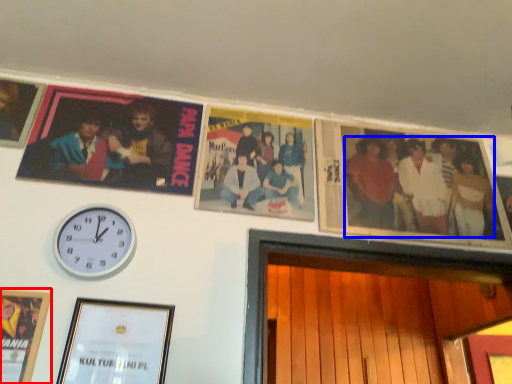
Question: Which object appears farthest to the camera in this image, picture frame (highlighted by a red box) or person (highlighted by a blue box)?

Choices:
 (A) picture frame
 (B) person

Answer: (B)